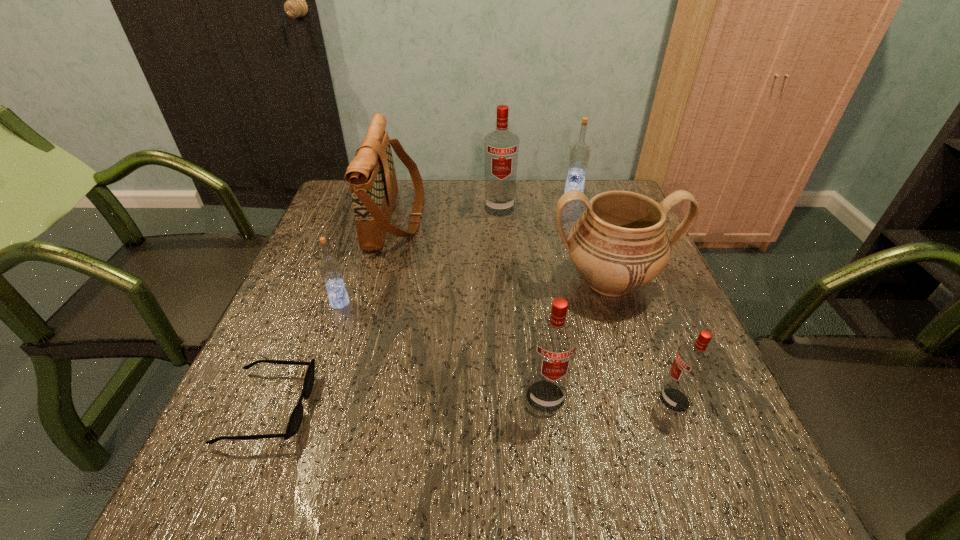
Select which red vodka is the closest to the shoulder bag. Please provide its 2D coordinates. Your answer should be formatted as a tuple, i.e. [(x, y)], where the tuple contains the x and y coordinates of a point satisfying the conditions above.

[(501, 147)]

Locate which red vodka ranks in proximity to the shortest object. Please provide its 2D coordinates. Your answer should be formatted as a tuple, i.e. [(x, y)], where the tuple contains the x and y coordinates of a point satisfying the conditions above.

[(554, 341)]

Find the location of `vacant space that satisfies the following two spatial constraints: 1. on the front-facing side of the urn; 2. on the front-facing side of the black sunglasses`. vacant space that satisfies the following two spatial constraints: 1. on the front-facing side of the urn; 2. on the front-facing side of the black sunglasses is located at coordinates (651, 407).

Identify the location of vacant space that satisfies the following two spatial constraints: 1. on the front-facing side of the urn; 2. on the front-facing side of the shortest object. The height and width of the screenshot is (540, 960). (651, 407).